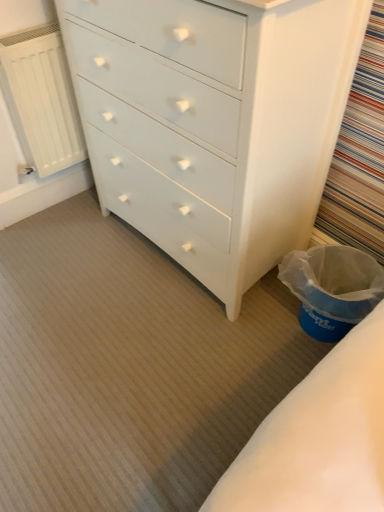
Identify the location of vacant area on top of white matte radiator at left (from a real-world perspective). (25, 33).